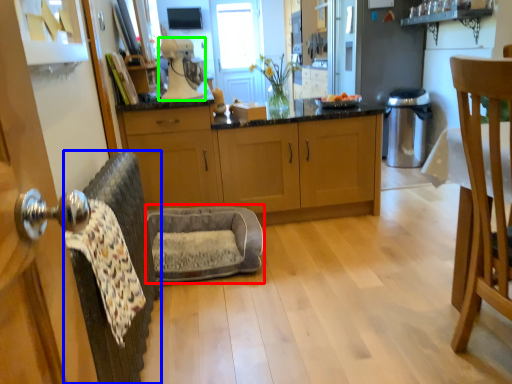
Question: Estimate the real-world distances between objects in this image. Which object is closer to swivel chair (highlighted by a red box), swivel chair (highlighted by a blue box) or coffee machine (highlighted by a green box)?

Choices:
 (A) swivel chair
 (B) coffee machine

Answer: (A)